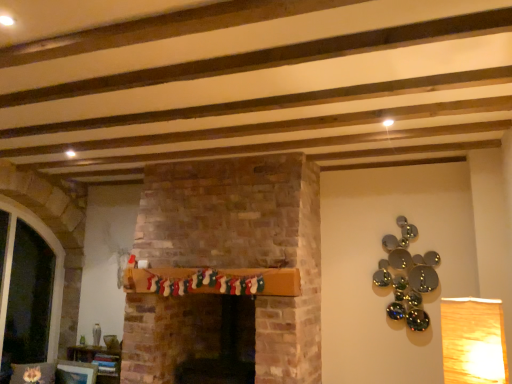
Question: From the image's perspective, relative to matte white picture frame at lower left, is transparent glass door at left above or below?

Choices:
 (A) below
 (B) above

Answer: (B)

Question: In the image, is transparent glass door at left positioned in front of or behind matte white picture frame at lower left?

Choices:
 (A) behind
 (B) front

Answer: (B)

Question: Which object is the farthest from the matte white picture frame at lower left?

Choices:
 (A) wooden bookshelf at lower left
 (B) wooden mantel at center
 (C) transparent glass door at left
 (D) velvet cushion at lower left

Answer: (B)

Question: Estimate the real-world distances between objects in this image. Which object is closer to the matte white picture frame at lower left?

Choices:
 (A) wooden mantel at center
 (B) transparent glass door at left
 (C) wooden bookshelf at lower left
 (D) velvet cushion at lower left

Answer: (D)